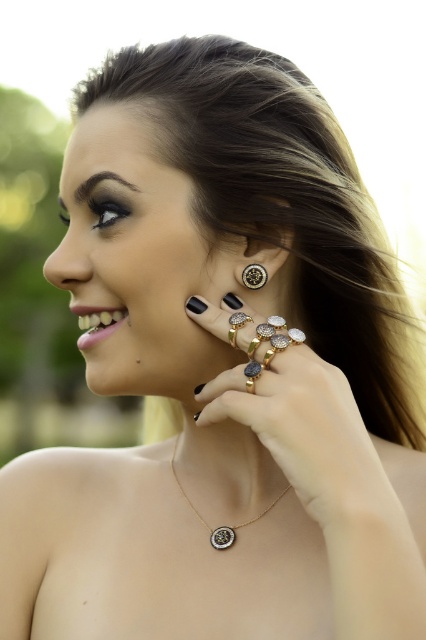
Question: Among these objects, which one is nearest to the camera?

Choices:
 (A) gold metallic necklace at center
 (B) gold metallic ring at upper right
 (C) gold textured earring at upper right

Answer: (B)

Question: Does gold textured earring at upper right appear on the right side of gold metallic ring at upper right?

Choices:
 (A) no
 (B) yes

Answer: (B)

Question: Which of the following is the closest to the observer?

Choices:
 (A) gold metallic ring at upper right
 (B) gold textured earring at upper right
 (C) gold metallic necklace at center

Answer: (A)

Question: Which point is farther to the camera?

Choices:
 (A) gold metallic ring at upper right
 (B) gold metallic necklace at center

Answer: (B)

Question: In this image, where is gold metallic necklace at center located relative to gold metallic ring at upper right?

Choices:
 (A) right
 (B) left

Answer: (B)

Question: Is gold textured earring at upper right to the left of gold metallic ring at upper right from the viewer's perspective?

Choices:
 (A) yes
 (B) no

Answer: (B)